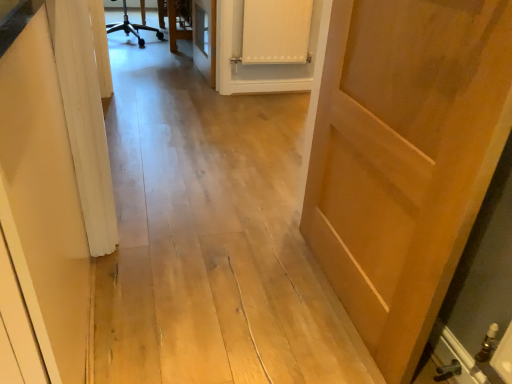
What is the approximate height of white matte cabinet at upper center?

The height of white matte cabinet at upper center is 21.16 inches.

Locate an element on the screen. The width and height of the screenshot is (512, 384). white matte cabinet at upper center is located at coordinates (276, 31).

What do you see at coordinates (276, 31) in the screenshot?
I see `white matte cabinet at upper center` at bounding box center [276, 31].

Locate an element on the screen. This screenshot has height=384, width=512. matte wood door at right is located at coordinates (404, 158).

What is the approximate width of matte wood door at right?

matte wood door at right is 5.51 inches in width.

Image resolution: width=512 pixels, height=384 pixels. What do you see at coordinates (404, 158) in the screenshot?
I see `matte wood door at right` at bounding box center [404, 158].

Where is `white matte cabinet at upper center`? This screenshot has height=384, width=512. white matte cabinet at upper center is located at coordinates (276, 31).

Which object is positioned more to the right, white matte cabinet at upper center or matte wood door at right?

matte wood door at right is more to the right.

Is the depth of white matte cabinet at upper center greater than that of matte wood door at right?

Yes, the depth of white matte cabinet at upper center is greater than that of matte wood door at right.

Which is in front, point (277, 16) or point (423, 124)?

The point (423, 124) is in front.

From the image's perspective, is white matte cabinet at upper center located above matte wood door at right?

Indeed, from the image's perspective, white matte cabinet at upper center is shown above matte wood door at right.

From a real-world perspective, which is physically above, white matte cabinet at upper center or matte wood door at right?

In real-world perspective, matte wood door at right is above.

Can you confirm if white matte cabinet at upper center is wider than matte wood door at right?

No, white matte cabinet at upper center is not wider than matte wood door at right.

Considering the sizes of white matte cabinet at upper center and matte wood door at right in the image, is white matte cabinet at upper center taller or shorter than matte wood door at right?

Clearly, white matte cabinet at upper center is shorter compared to matte wood door at right.

Considering the sizes of objects white matte cabinet at upper center and matte wood door at right in the image provided, who is bigger, white matte cabinet at upper center or matte wood door at right?

With larger size is matte wood door at right.

Is matte wood door at right a part of white matte cabinet at upper center?

Actually, matte wood door at right is outside white matte cabinet at upper center.

Is white matte cabinet at upper center not close to matte wood door at right?

Yes.

Is white matte cabinet at upper center oriented towards matte wood door at right?

Yes, white matte cabinet at upper center is turned towards matte wood door at right.

What's the angular difference between white matte cabinet at upper center and matte wood door at right's facing directions?

89.6 degrees separate the facing orientations of white matte cabinet at upper center and matte wood door at right.

How far apart are white matte cabinet at upper center and matte wood door at right?

white matte cabinet at upper center is 6.46 feet away from matte wood door at right.

Locate an element on the screen. This screenshot has height=384, width=512. door below the white matte cabinet at upper center (from the image's perspective) is located at coordinates (404, 158).

Which is more to the left, matte wood door at right or white matte cabinet at upper center?

white matte cabinet at upper center is more to the left.

Is matte wood door at right further to the viewer compared to white matte cabinet at upper center?

No, it is in front of white matte cabinet at upper center.

Is point (492, 151) positioned after point (265, 52)?

That is False.

From the image's perspective, between matte wood door at right and white matte cabinet at upper center, which one is located above?

white matte cabinet at upper center appears higher in the image.

From a real-world perspective, is matte wood door at right physically located above or below white matte cabinet at upper center?

matte wood door at right is above white matte cabinet at upper center.

Considering the sizes of objects matte wood door at right and white matte cabinet at upper center in the image provided, who is thinner, matte wood door at right or white matte cabinet at upper center?

Thinner between the two is white matte cabinet at upper center.

Who is shorter, matte wood door at right or white matte cabinet at upper center?

Standing shorter between the two is white matte cabinet at upper center.

Considering the relative sizes of matte wood door at right and white matte cabinet at upper center in the image provided, is matte wood door at right smaller than white matte cabinet at upper center?

No, matte wood door at right is not smaller than white matte cabinet at upper center.

Do you think matte wood door at right is within white matte cabinet at upper center, or outside of it?

matte wood door at right is not inside white matte cabinet at upper center, it's outside.

Is matte wood door at right next to white matte cabinet at upper center?

No, matte wood door at right is not in contact with white matte cabinet at upper center.

Could you tell me if matte wood door at right is facing white matte cabinet at upper center?

No, matte wood door at right is not facing towards white matte cabinet at upper center.

How many degrees apart are the facing directions of matte wood door at right and white matte cabinet at upper center?

matte wood door at right and white matte cabinet at upper center are facing 89.6 degrees away from each other.

Identify the location of door that is below the white matte cabinet at upper center (from the image's perspective). The image size is (512, 384). (404, 158).

You are a GUI agent. You are given a task and a screenshot of the screen. Output one action in this format:
    pyautogui.click(x=<x>, y=<y>)
    Task: Click on the cabinetry below the matte wood door at right (from a real-world perspective)
    This screenshot has height=384, width=512.
    Given the screenshot: What is the action you would take?
    pyautogui.click(x=276, y=31)

Identify the location of cabinetry above the matte wood door at right (from the image's perspective). The image size is (512, 384). pyautogui.click(x=276, y=31).